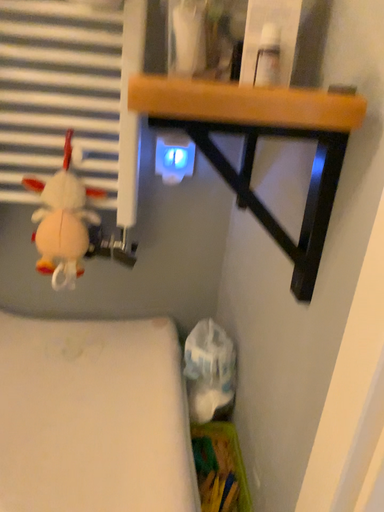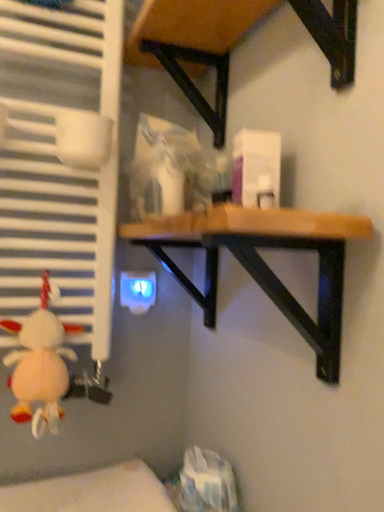
Question: Which way did the camera rotate in the video?

Choices:
 (A) rotated right
 (B) rotated left

Answer: (A)